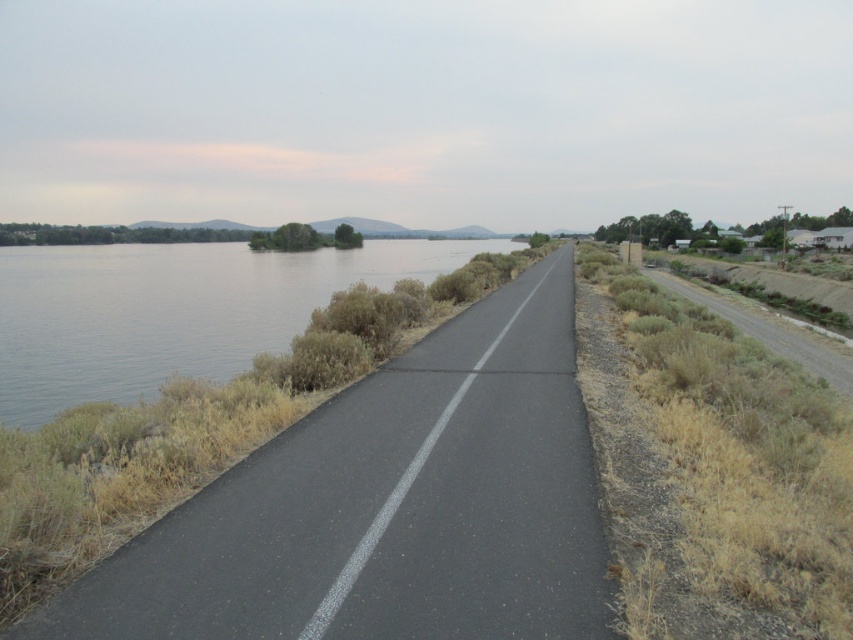
You are driving a car that is 4 meters wide. You need to cross the road from the clear water at left to the dry grass at right. Is there enough space between them for your car to pass through?

The clear water at left and dry grass at right are 46.53 meters apart, so yes, the car can pass through the space between them since it is wider than the car.

You are standing at the starting point of the road and want to reach both the point marked as point (306, 492) and the point marked as point (833, 349). Which point will you reach first as you walk along the road?

You will reach point (306, 492) first because it is closer to the viewer than point (833, 349), which is further away along the road.

You are standing at the edge of the road and want to reach a specific point marked as point [381,456]. If your walking speed is 1.5 meters per second, how long will it take you to reach that point?

The distance of point [381,456] from camera is 7.57 meters. At a walking speed of 1.5 meters per second, it will take approximately 5.05 seconds to reach the point.